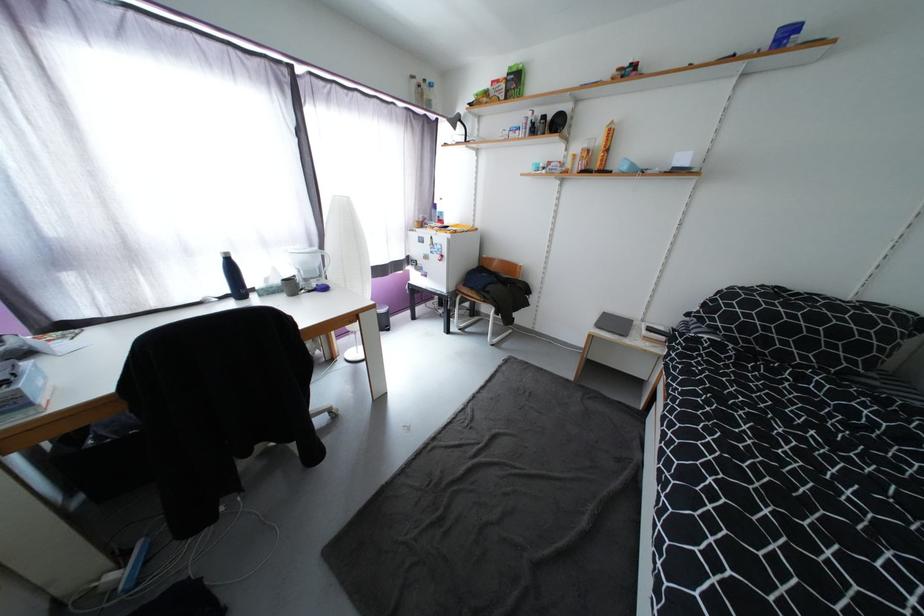
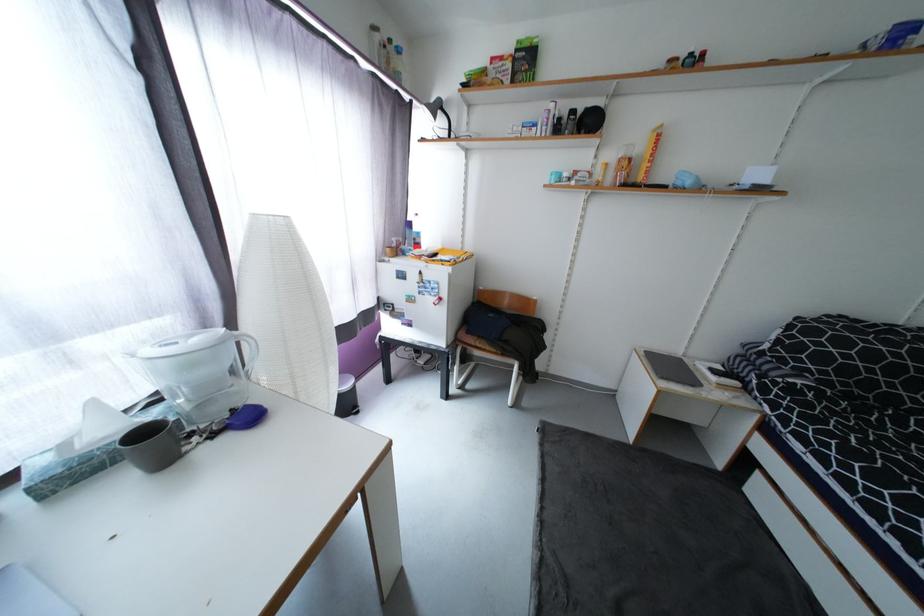
In the second image, find the point that corresponds to the point at 281,270 in the first image.

(102, 407)